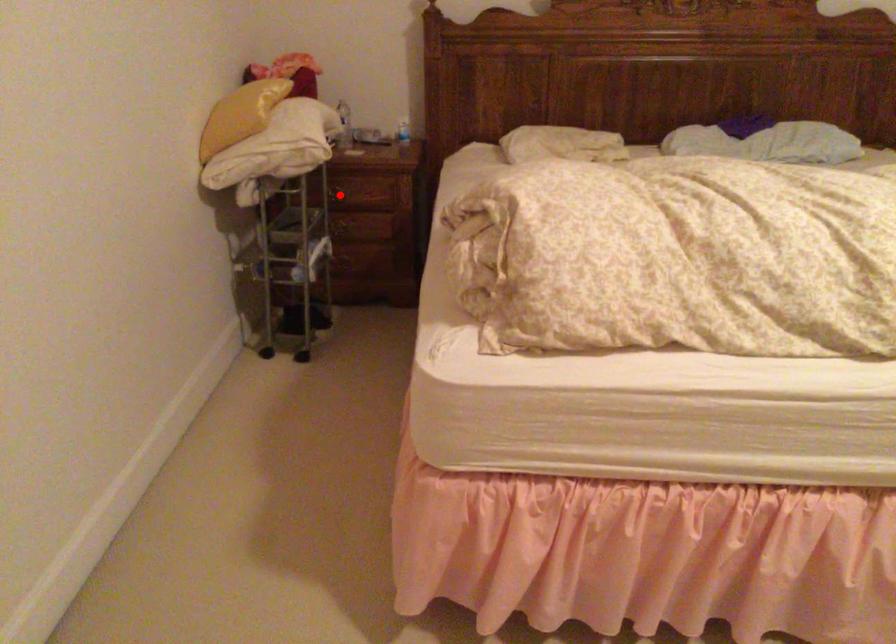
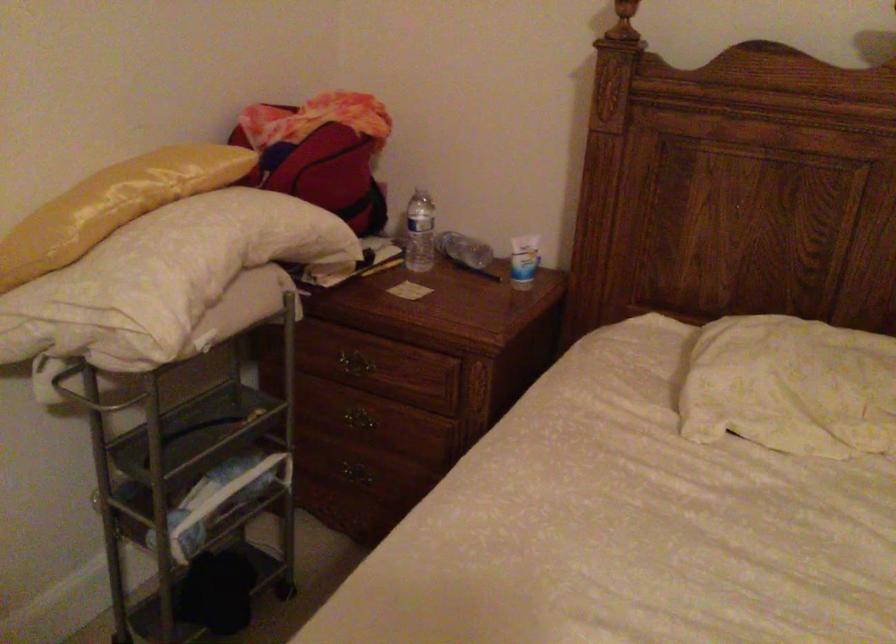
Find the pixel in the second image that matches the highlighted location in the first image.

(350, 365)